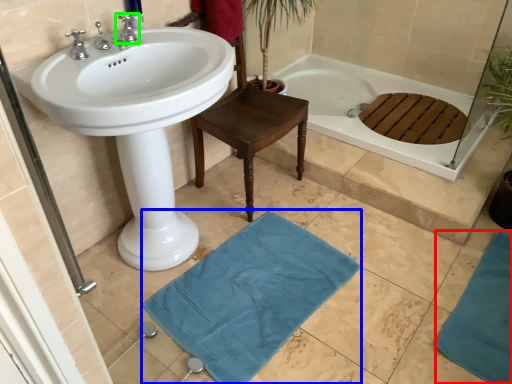
Question: Which object is the farthest from bath mat (highlighted by a red box)? Choose among these: bath mat (highlighted by a blue box) or tap (highlighted by a green box).

Choices:
 (A) bath mat
 (B) tap

Answer: (B)